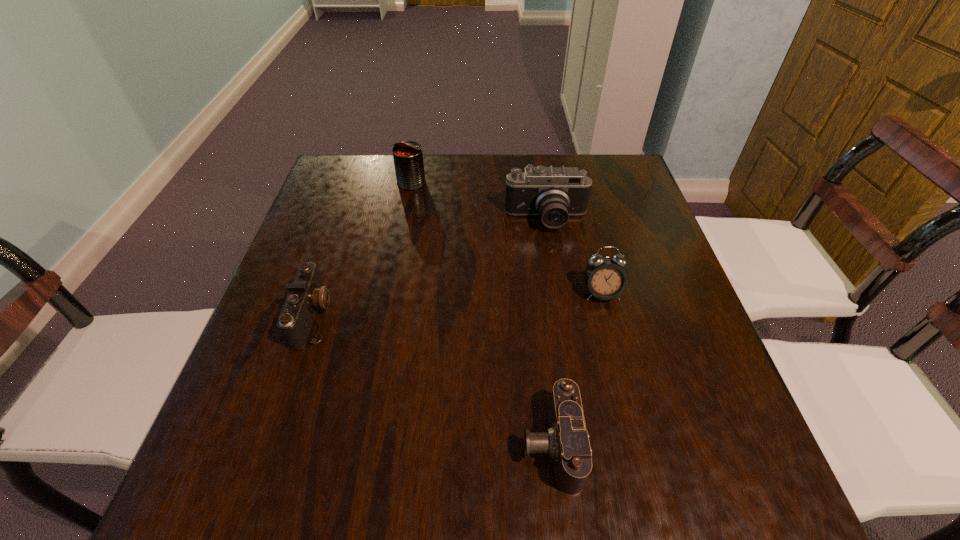
Locate an element on the screen. free space that satisfies the following two spatial constraints: 1. on the face of the alarm clock; 2. on the front-facing side of the leftmost camera is located at coordinates (608, 316).

Locate an element on the screen. This screenshot has width=960, height=540. vacant space that satisfies the following two spatial constraints: 1. on the face of the third shortest object; 2. on the front-facing side of the leftmost object is located at coordinates (608, 316).

Where is `vacant space that satisfies the following two spatial constraints: 1. on the face of the alarm clock; 2. on the front-facing side of the second nearest camera`? This screenshot has height=540, width=960. vacant space that satisfies the following two spatial constraints: 1. on the face of the alarm clock; 2. on the front-facing side of the second nearest camera is located at coordinates (608, 316).